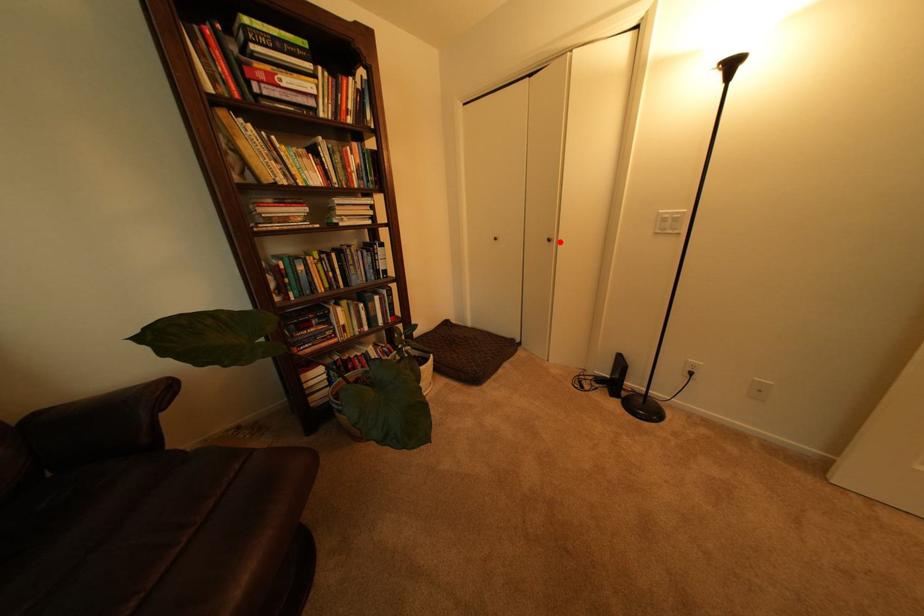
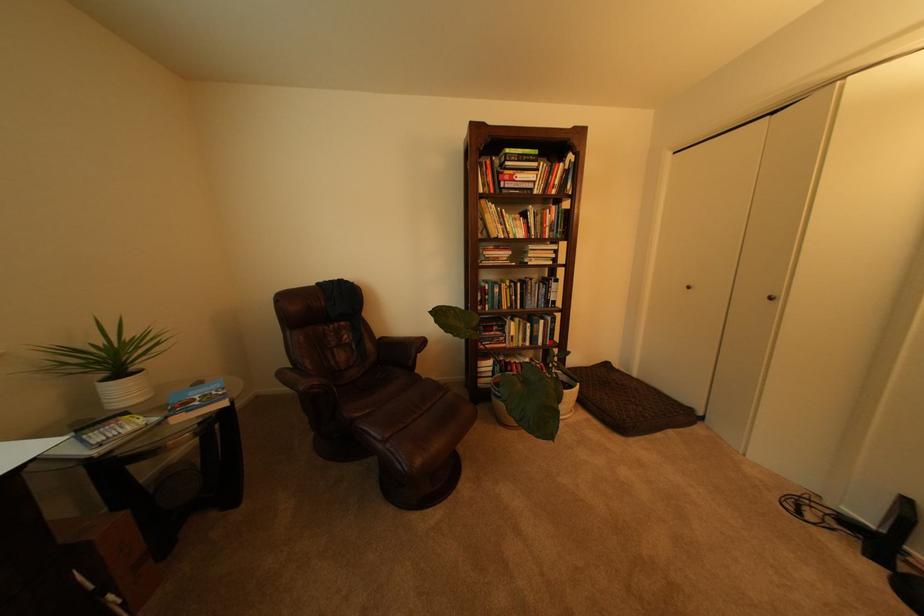
The point at the highlighted location is marked in the first image. Where is the corresponding point in the second image?

(782, 300)